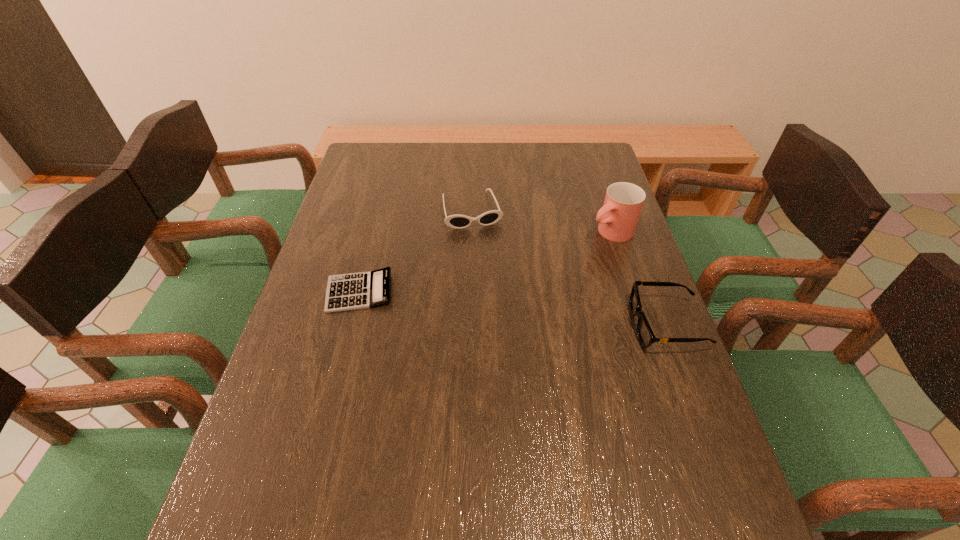
Find the location of a particular element. free space at the near edge of the desktop is located at coordinates (558, 468).

The width and height of the screenshot is (960, 540). Find the location of `vacant space at the left edge`. vacant space at the left edge is located at coordinates (322, 405).

Locate an element on the screen. The height and width of the screenshot is (540, 960). vacant area at the right edge is located at coordinates (606, 247).

In order to click on vacant area at the far left corner in this screenshot , I will do `click(398, 159)`.

In the image, there is a desktop. Where is `free space at the far right corner`? free space at the far right corner is located at coordinates (585, 147).

In the image, there is a desktop. Where is `vacant region at the near right corner`? The width and height of the screenshot is (960, 540). vacant region at the near right corner is located at coordinates (640, 475).

The image size is (960, 540). In order to click on free spot between the nearer sunglasses and the leftmost object in this screenshot , I will do `click(513, 308)`.

You are a GUI agent. You are given a task and a screenshot of the screen. Output one action in this format:
    pyautogui.click(x=<x>, y=<y>)
    Task: Click on the free space between the shortest object and the cup
    
    Given the screenshot: What is the action you would take?
    pyautogui.click(x=485, y=262)

This screenshot has width=960, height=540. Find the location of `free spot between the right sunglasses and the tallest object`. free spot between the right sunglasses and the tallest object is located at coordinates (638, 278).

Where is `vacant space that is in between the third object from right to left and the tallest object`? vacant space that is in between the third object from right to left and the tallest object is located at coordinates (541, 221).